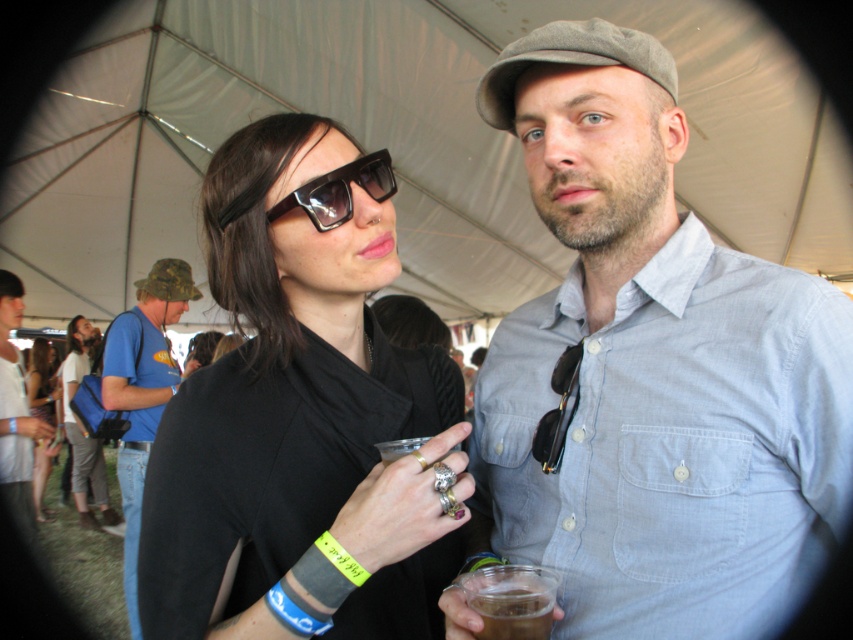
What are the coordinates of the black plastic sunglasses at upper left?

The black plastic sunglasses at upper left are located at coordinates point [339,189].

You are at a festival and see a person wearing sunglasses. The sunglasses are located at point (339, 189). If you want to find the sunglasses, which person should you look at?

The black plastic sunglasses at upper left is represented by point (339, 189), so you should look at the person on the left.